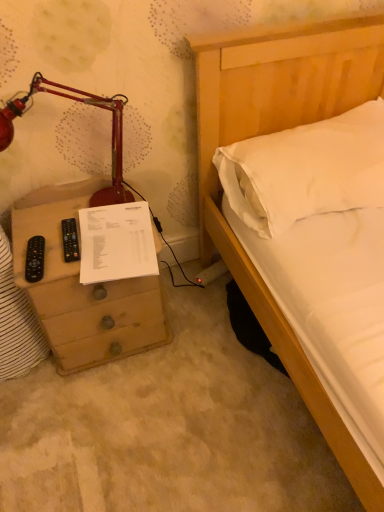
Find the location of `vacant region under matte red lamp at left (from a real-world perspective)`. vacant region under matte red lamp at left (from a real-world perspective) is located at coordinates (66, 215).